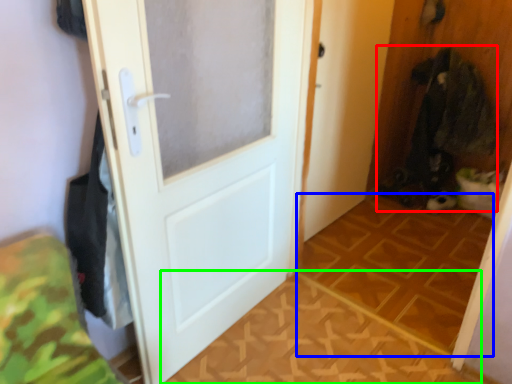
Question: Based on their relative distances, which object is nearer to laundry (highlighted by a red box)? Choose from tile (highlighted by a blue box) and tile (highlighted by a green box).

Choices:
 (A) tile
 (B) tile

Answer: (A)